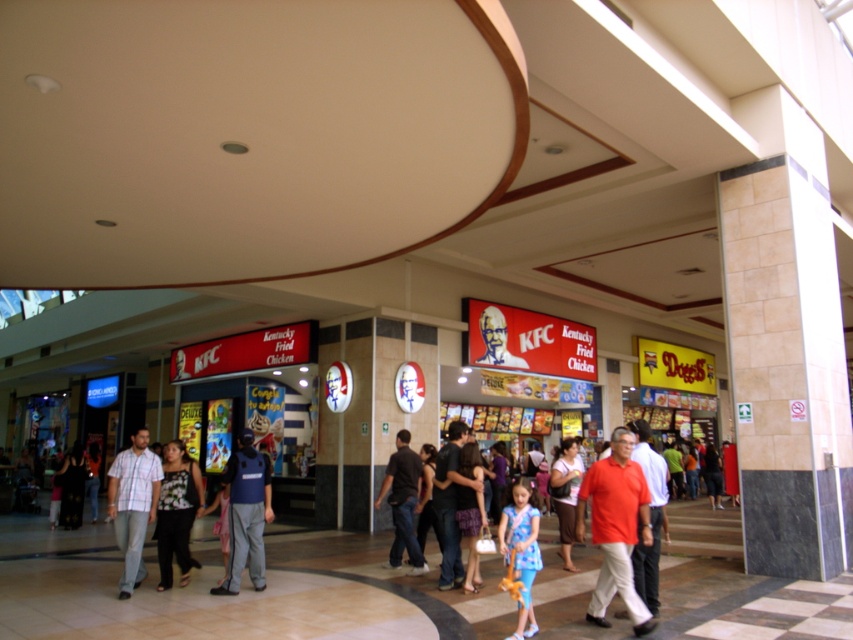
You are a customer standing at the entrance of the KFC outlet in the food court. You notice two people wearing a dark blue uniform at center and a dark brown leather jacket at center. Which one is closer to the entrance?

The dark blue uniform at center is closer to the entrance because it is positioned to the left of the dark brown leather jacket at center, which would place it nearer to the entrance area.

You are a customer in the food court and you notice two shirts at the center of the KFC outlet. The black cotton shirt at center and the matte red shirt at center. Which shirt is positioned lower?

The black cotton shirt at center is below the matte red shirt at center, so the black cotton shirt at center is positioned lower.